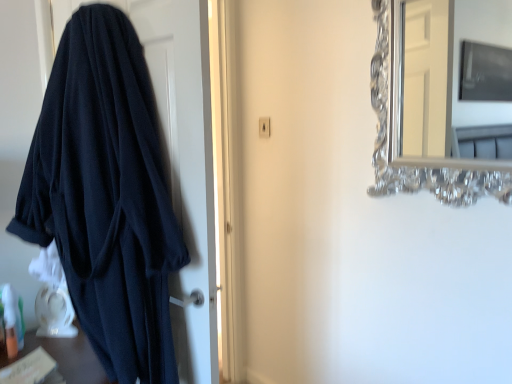
Question: In the image, is dark blue fabric at left positioned in front of or behind silver metallic mirror at upper right?

Choices:
 (A) behind
 (B) front

Answer: (A)

Question: Looking at their shapes, would you say dark blue fabric at left is wider or thinner than silver metallic mirror at upper right?

Choices:
 (A) thin
 (B) wide

Answer: (B)

Question: Visually, is dark blue fabric at left positioned to the left or to the right of silver metallic mirror at upper right?

Choices:
 (A) left
 (B) right

Answer: (A)

Question: Is point (458, 4) positioned closer to the camera than point (181, 367)?

Choices:
 (A) closer
 (B) farther

Answer: (B)

Question: Do you think silver metallic mirror at upper right is within dark blue fabric at left, or outside of it?

Choices:
 (A) outside
 (B) inside

Answer: (A)

Question: In terms of height, does silver metallic mirror at upper right look taller or shorter compared to dark blue fabric at left?

Choices:
 (A) short
 (B) tall

Answer: (A)

Question: Is silver metallic mirror at upper right in front of or behind dark blue fabric at left in the image?

Choices:
 (A) front
 (B) behind

Answer: (A)